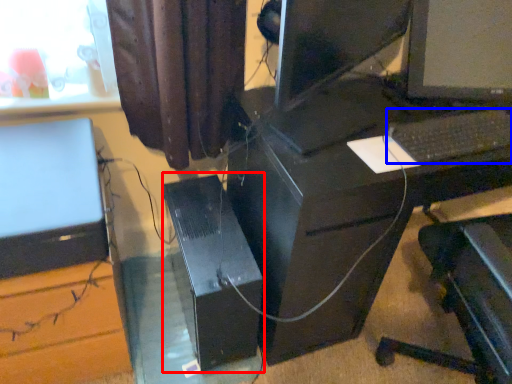
Question: Among these objects, which one is farthest to the camera, computer tower (highlighted by a red box) or computer keyboard (highlighted by a blue box)?

Choices:
 (A) computer tower
 (B) computer keyboard

Answer: (A)